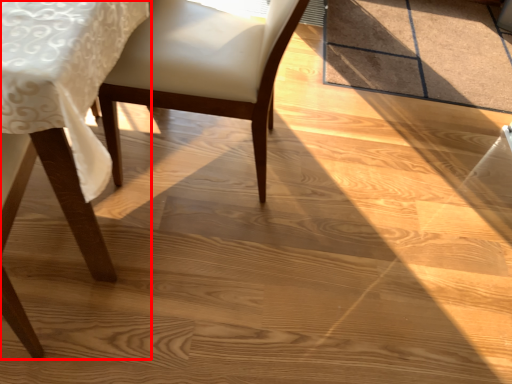
Question: From the image's perspective, where is chair (annotated by the red box) located relative to chair?

Choices:
 (A) below
 (B) above

Answer: (A)